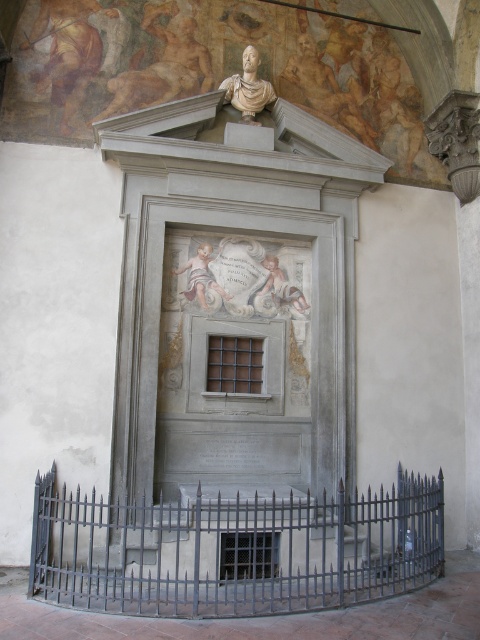
You are standing in front of the monument and want to take a photo of the point at coordinates (x=338, y=371). If your camera is positioned 8.73 meters away from this point, is the camera close enough to capture the entire monument in the frame?

The point at coordinates (x=338, y=371) is 8.73 meters away from the camera. Since the camera is positioned exactly at that distance, it should be able to capture the entire monument in the frame, assuming the lens used has an appropriate angle of view.

You are visiting the historical monument and want to touch the white marble plaque at center. However, there is a black metal fence at center in the way. Can you reach the plaque without moving the fence?

The white marble plaque at center is positioned over the black metal fence at center, meaning it is above the fence. Therefore, you can reach the plaque without needing to move the fence as it is accessible from above.

You are an art conservator examining the monument. You need to clean both the white marble plaque at center and the white marble bust at upper center. Which object should you clean first if you want to start with the one closer to you?

The white marble plaque at center is closer to the viewer than the white marble bust at upper center, so you should clean the white marble plaque at center first.